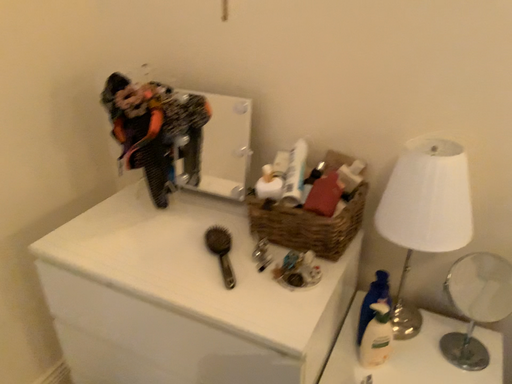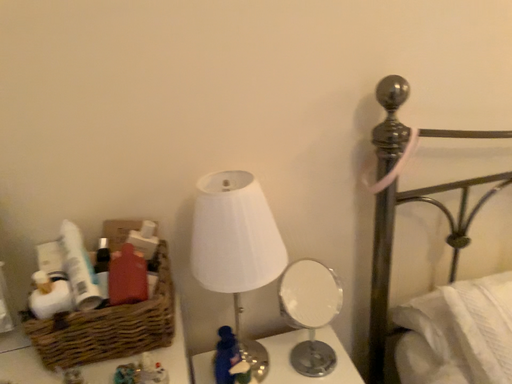
Question: Which way did the camera rotate in the video?

Choices:
 (A) rotated right
 (B) rotated left

Answer: (A)